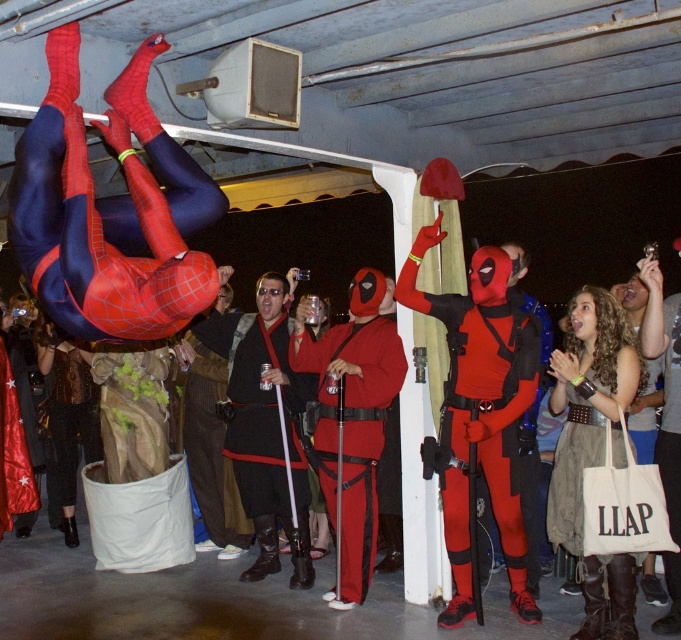
Can you confirm if red matte deadpool costume at center is wider than brown corduroy pants at center?

Yes, red matte deadpool costume at center is wider than brown corduroy pants at center.

Which is in front, point (353, 384) or point (219, 513)?

Positioned in front is point (353, 384).

Is point (360, 468) closer to viewer compared to point (221, 392)?

Yes, point (360, 468) is in front of point (221, 392).

Find the location of a particular element. The image size is (681, 640). red matte deadpool costume at center is located at coordinates (351, 432).

Is point (432, 240) farther from camera compared to point (550, 360)?

No.

Does matte red and black costume at center have a larger size compared to distressed canvas tote bag at lower right?

Correct, matte red and black costume at center is larger in size than distressed canvas tote bag at lower right.

The width and height of the screenshot is (681, 640). What do you see at coordinates (484, 381) in the screenshot?
I see `matte red and black costume at center` at bounding box center [484, 381].

Image resolution: width=681 pixels, height=640 pixels. What are the coordinates of `matte red and black costume at center` in the screenshot? It's located at (484, 381).

Who is shorter, distressed canvas tote bag at lower right or brown corduroy pants at center?

Standing shorter between the two is distressed canvas tote bag at lower right.

Between distressed canvas tote bag at lower right and brown corduroy pants at center, which one appears on the right side from the viewer's perspective?

Positioned to the right is distressed canvas tote bag at lower right.

Where is `distressed canvas tote bag at lower right`? The width and height of the screenshot is (681, 640). distressed canvas tote bag at lower right is located at coordinates (571, 481).

Identify the location of distressed canvas tote bag at lower right. (571, 481).